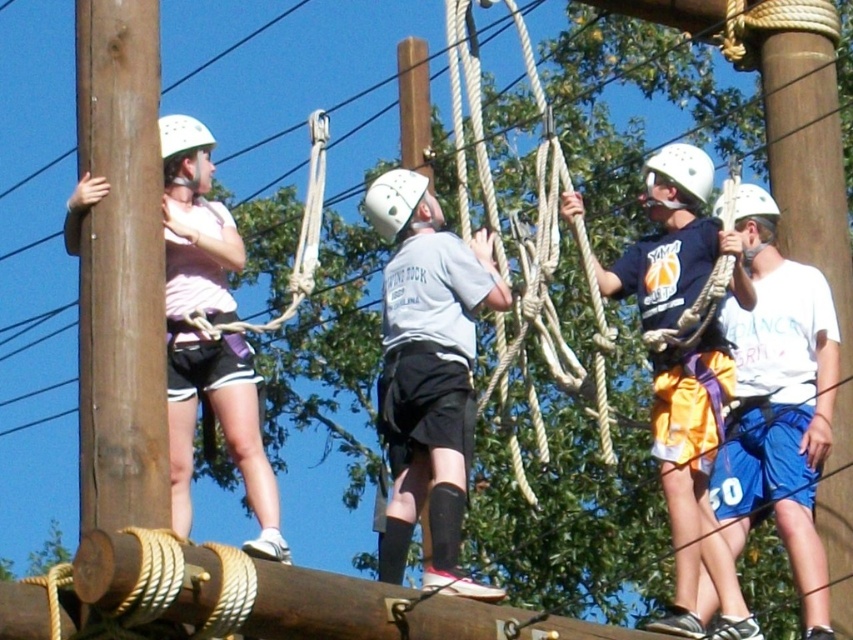
Does white cotton shirt at center have a greater width compared to matte blue shirt at center?

In fact, white cotton shirt at center might be narrower than matte blue shirt at center.

Can you confirm if white cotton shirt at center is positioned to the left of matte blue shirt at center?

No, white cotton shirt at center is not to the left of matte blue shirt at center.

This screenshot has height=640, width=853. In order to click on white cotton shirt at center in this screenshot , I will do `click(778, 404)`.

Does matte blue shirt at center appear on the left side of white matte helmet at upper center?

Indeed, matte blue shirt at center is positioned on the left side of white matte helmet at upper center.

Is matte blue shirt at center to the right of white matte helmet at upper center from the viewer's perspective?

In fact, matte blue shirt at center is to the left of white matte helmet at upper center.

Does point (665, 467) come behind point (682, 176)?

No, it is not.

This screenshot has width=853, height=640. I want to click on matte blue shirt at center, so (694, 481).

Does brown rough wood at left have a greater width compared to white matte helmet at upper left?

No.

Measure the distance between brown rough wood at left and camera.

brown rough wood at left is 162.67 feet from camera.

The height and width of the screenshot is (640, 853). Identify the location of brown rough wood at left. (120, 269).